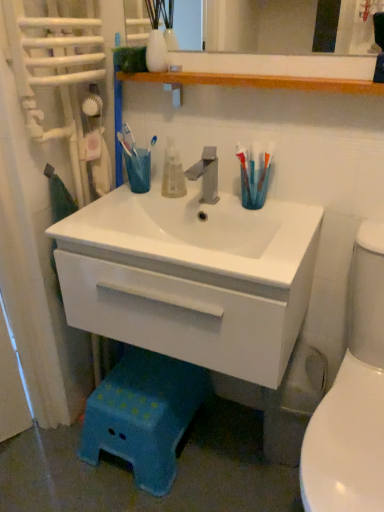
Image resolution: width=384 pixels, height=512 pixels. I want to click on unoccupied region to the right of translucent plastic toothbrush at right, so click(296, 207).